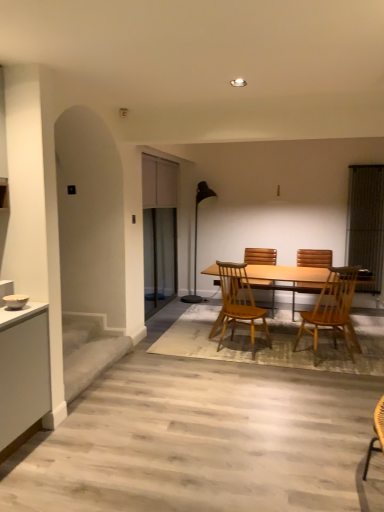
Question: Is wooden chair at center, the 4th chair in the back-to-front sequence, looking in the opposite direction of black metal floor lamp at center?

Choices:
 (A) no
 (B) yes

Answer: (A)

Question: Considering the relative sizes of wooden chair at center, acting as the 1th chair starting from the front, and black metal floor lamp at center in the image provided, is wooden chair at center, acting as the 1th chair starting from the front, thinner than black metal floor lamp at center?

Choices:
 (A) no
 (B) yes

Answer: (A)

Question: From a real-world perspective, is wooden chair at center, acting as the 1th chair starting from the front, over black metal floor lamp at center?

Choices:
 (A) yes
 (B) no

Answer: (B)

Question: Is wooden chair at center, acting as the 1th chair starting from the front, at the right side of black metal floor lamp at center?

Choices:
 (A) yes
 (B) no

Answer: (A)

Question: From a real-world perspective, is wooden chair at center, the 4th chair in the back-to-front sequence, positioned under black metal floor lamp at center based on gravity?

Choices:
 (A) no
 (B) yes

Answer: (B)

Question: Is clear glass screen door at center bigger or smaller than light brown wooden chair at center, which ranks as the 3th chair in back-to-front order?

Choices:
 (A) big
 (B) small

Answer: (A)

Question: Looking at their shapes, would you say clear glass screen door at center is wider or thinner than light brown wooden chair at center, which ranks as the 3th chair in back-to-front order?

Choices:
 (A) wide
 (B) thin

Answer: (B)

Question: From a real-world perspective, is clear glass screen door at center physically located above or below light brown wooden chair at center, which ranks as the 3th chair in back-to-front order?

Choices:
 (A) below
 (B) above

Answer: (B)

Question: Considering their positions, is clear glass screen door at center located in front of or behind light brown wooden chair at center, which ranks as the 3th chair in back-to-front order?

Choices:
 (A) front
 (B) behind

Answer: (B)

Question: Is wooden chair at center, acting as the 1th chair starting from the front, inside the boundaries of light brown wooden chair at center, which is counted as the second chair, starting from the front, or outside?

Choices:
 (A) inside
 (B) outside

Answer: (B)

Question: Is wooden chair at center, acting as the 1th chair starting from the front, taller or shorter than light brown wooden chair at center, which ranks as the 3th chair in back-to-front order?

Choices:
 (A) short
 (B) tall

Answer: (B)

Question: Relative to light brown wooden chair at center, which is counted as the second chair, starting from the front, is wooden chair at center, the 4th chair in the back-to-front sequence, in front or behind?

Choices:
 (A) behind
 (B) front

Answer: (B)

Question: Is point (332, 321) positioned closer to the camera than point (263, 324)?

Choices:
 (A) closer
 (B) farther

Answer: (A)

Question: Considering their positions, is black mesh screen at right located in front of or behind light brown wooden table at center?

Choices:
 (A) front
 (B) behind

Answer: (B)

Question: Considering the positions of black mesh screen at right and light brown wooden table at center in the image, is black mesh screen at right wider or thinner than light brown wooden table at center?

Choices:
 (A) thin
 (B) wide

Answer: (A)